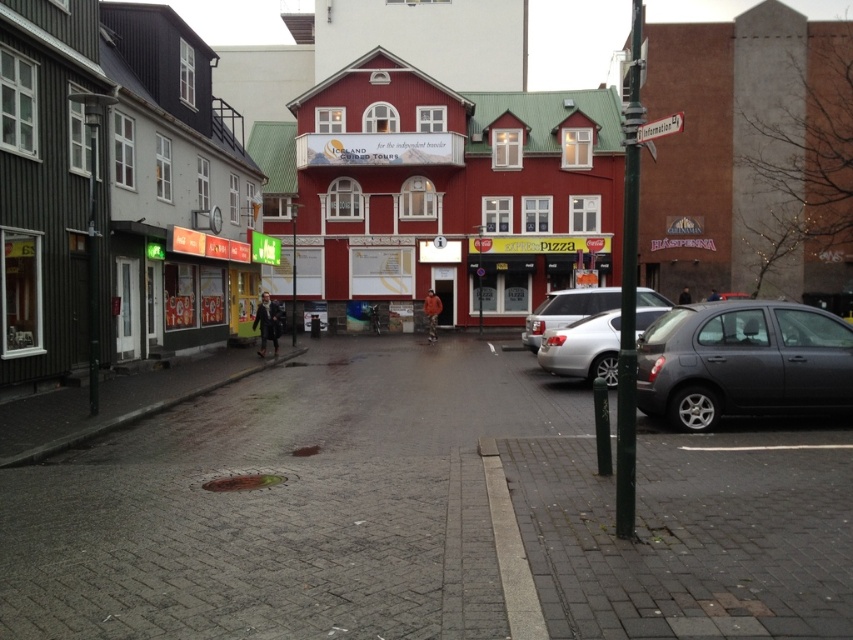
Question: Observing the image, what is the correct spatial positioning of silver metallic sedan at center in reference to satin silver sedan at center?

Choices:
 (A) right
 (B) left

Answer: (B)

Question: Which object appears closest to the camera in this image?

Choices:
 (A) red painted building at center
 (B) satin silver sedan at center
 (C) matte gray hatchback at right
 (D) silver metallic sedan at center

Answer: (B)

Question: Which point is farther to the camera?

Choices:
 (A) (631, 515)
 (B) (570, 339)

Answer: (B)

Question: Which object appears farthest from the camera in this image?

Choices:
 (A) red painted building at center
 (B) brick paved street at center
 (C) matte gray hatchback at right
 (D) silver metallic sedan at center

Answer: (A)

Question: In this image, where is green metallic pole at right located relative to satin silver sedan at center?

Choices:
 (A) left
 (B) right

Answer: (B)

Question: Can you confirm if matte gray hatchback at right is positioned below silver metallic sedan at center?

Choices:
 (A) yes
 (B) no

Answer: (B)